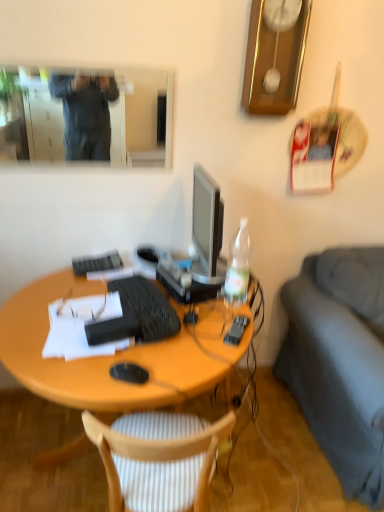
The width and height of the screenshot is (384, 512). In order to click on free spot to the left of clear plastic bottle at right in this screenshot , I will do `click(209, 307)`.